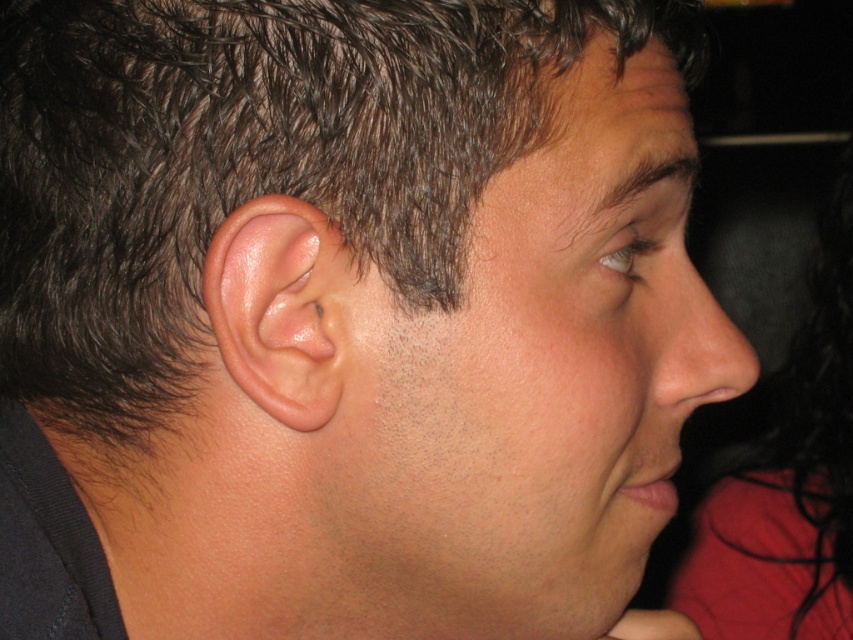
Between smooth skin face at center and dark brown hair at upper left, which one is positioned higher?

dark brown hair at upper left

Which is in front, point (370, 493) or point (291, 157)?

Positioned in front is point (291, 157).

Measure the distance between point (596, 433) and camera.

A distance of 13.07 inches exists between point (596, 433) and camera.

You are a GUI agent. You are given a task and a screenshot of the screen. Output one action in this format:
    pyautogui.click(x=<x>, y=<y>)
    Task: Click on the smooth skin face at center
    The height and width of the screenshot is (640, 853).
    Given the screenshot: What is the action you would take?
    coord(527,385)

Which of these two, dark brown hair at upper left or dark red hair at right, stands taller?

dark red hair at right

How much distance is there between dark brown hair at upper left and dark red hair at right?

dark brown hair at upper left and dark red hair at right are 24.72 inches apart from each other.

The width and height of the screenshot is (853, 640). Describe the element at coordinates (252, 160) in the screenshot. I see `dark brown hair at upper left` at that location.

The height and width of the screenshot is (640, 853). Find the location of `dark brown hair at upper left`. dark brown hair at upper left is located at coordinates (252, 160).

Who is more distant from viewer, (173, 147) or (331, 314)?

The point (173, 147) is behind.

Can you confirm if dark brown hair at upper left is shorter than pink flesh/soft tissue ear at center?

Incorrect, dark brown hair at upper left's height does not fall short of pink flesh/soft tissue ear at center's.

Who is more forward, (x=317, y=35) or (x=282, y=333)?

Point (x=317, y=35) is in front.

Find the location of `dark brown hair at upper left`. dark brown hair at upper left is located at coordinates (252, 160).